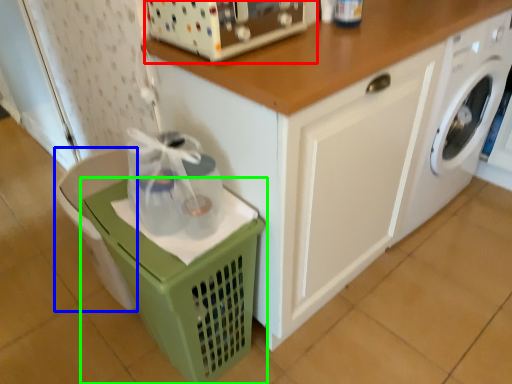
Question: Which is farther away from appliance (highlighted by a red box)? dish washer (highlighted by a blue box) or basket (highlighted by a green box)?

Choices:
 (A) dish washer
 (B) basket

Answer: (A)